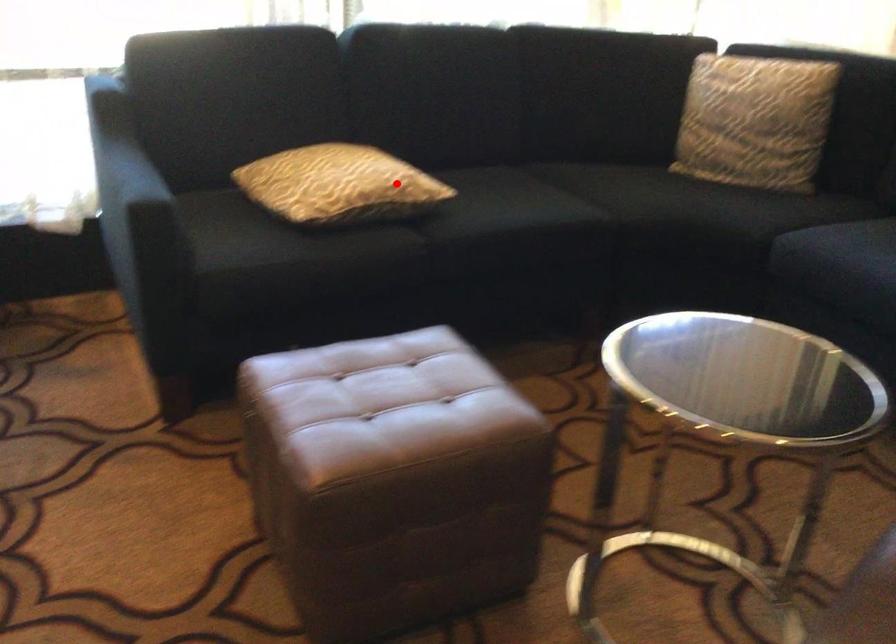
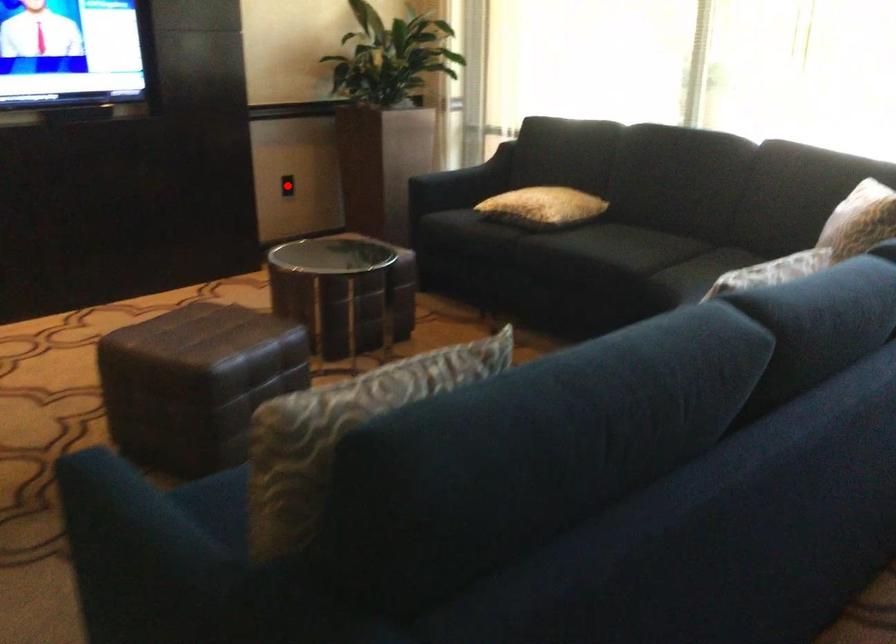
I am providing you with two images of the same scene from different viewpoints. A red point is marked on the first image and another point is marked on the second image. Does the point marked in image1 correspond to the same location as the one in image2?

No